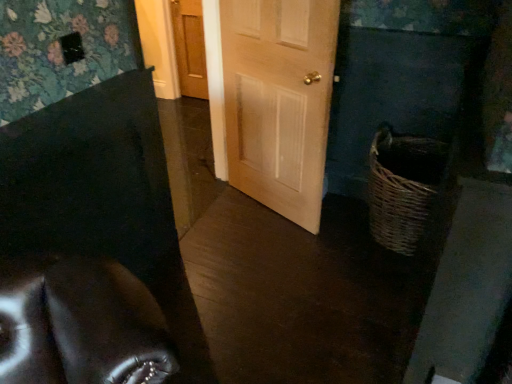
Question: Is wooden door at center, positioned as the second door in front-to-back order, thinner than woven brown basket at lower right?

Choices:
 (A) yes
 (B) no

Answer: (A)

Question: Does wooden door at center, which is counted as the first door, starting from the left, have a larger size compared to woven brown basket at lower right?

Choices:
 (A) yes
 (B) no

Answer: (B)

Question: Can you confirm if wooden door at center, the first door when ordered from back to front, is positioned to the left of woven brown basket at lower right?

Choices:
 (A) no
 (B) yes

Answer: (B)

Question: From a real-world perspective, is wooden door at center, which is counted as the first door, starting from the left, over woven brown basket at lower right?

Choices:
 (A) no
 (B) yes

Answer: (B)

Question: From a real-world perspective, is wooden door at center, the second door positioned from the right, below woven brown basket at lower right?

Choices:
 (A) yes
 (B) no

Answer: (B)

Question: Considering the positions of point (406, 208) and point (201, 36), is point (406, 208) closer or farther from the camera than point (201, 36)?

Choices:
 (A) farther
 (B) closer

Answer: (B)

Question: Do you think woven brown basket at lower right is within wooden door at center, the second door when ordered from bottom to top, or outside of it?

Choices:
 (A) inside
 (B) outside

Answer: (B)

Question: In terms of height, does woven brown basket at lower right look taller or shorter compared to wooden door at center, which is counted as the first door, starting from the left?

Choices:
 (A) tall
 (B) short

Answer: (B)

Question: From a real-world perspective, is woven brown basket at lower right above or below wooden door at center, the second door positioned from the right?

Choices:
 (A) above
 (B) below

Answer: (B)

Question: From the image's perspective, is light wood door at center, which is counted as the first door, starting from the bottom, above or below wooden door at center, the first door when ordered from back to front?

Choices:
 (A) above
 (B) below

Answer: (B)

Question: In terms of width, does light wood door at center, which is the 1th door from front to back, look wider or thinner when compared to wooden door at center, the second door positioned from the right?

Choices:
 (A) wide
 (B) thin

Answer: (A)

Question: Visually, is light wood door at center, which is the second door from left to right, positioned to the left or to the right of wooden door at center, the first door viewed from the top?

Choices:
 (A) left
 (B) right

Answer: (B)

Question: Is light wood door at center, which appears as the 2th door when viewed from the back, inside or outside of wooden door at center, the first door when ordered from back to front?

Choices:
 (A) inside
 (B) outside

Answer: (B)

Question: Is wooden door at center, positioned as the second door in front-to-back order, situated inside woven brown basket at lower right or outside?

Choices:
 (A) outside
 (B) inside

Answer: (A)

Question: Relative to woven brown basket at lower right, is wooden door at center, the first door when ordered from back to front, in front or behind?

Choices:
 (A) front
 (B) behind

Answer: (B)